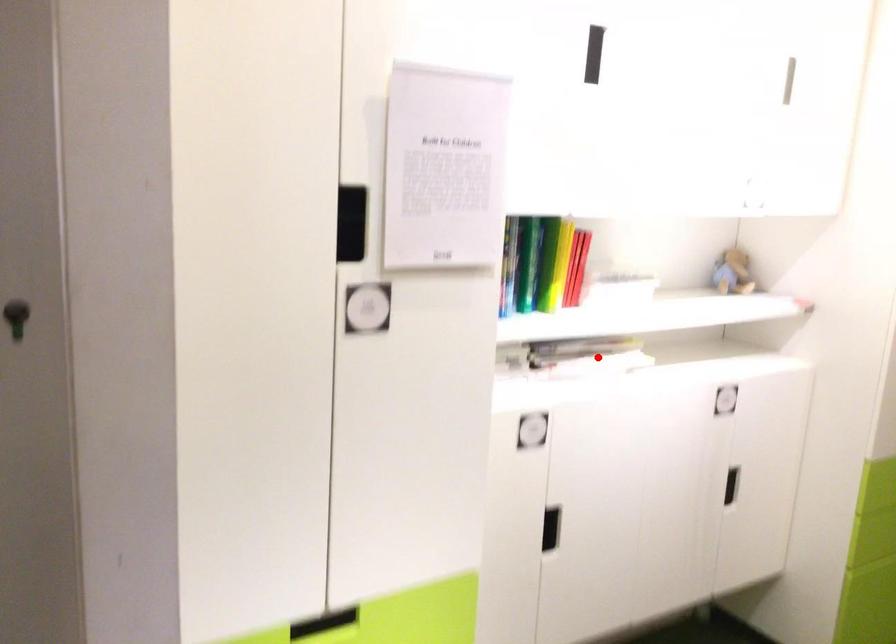
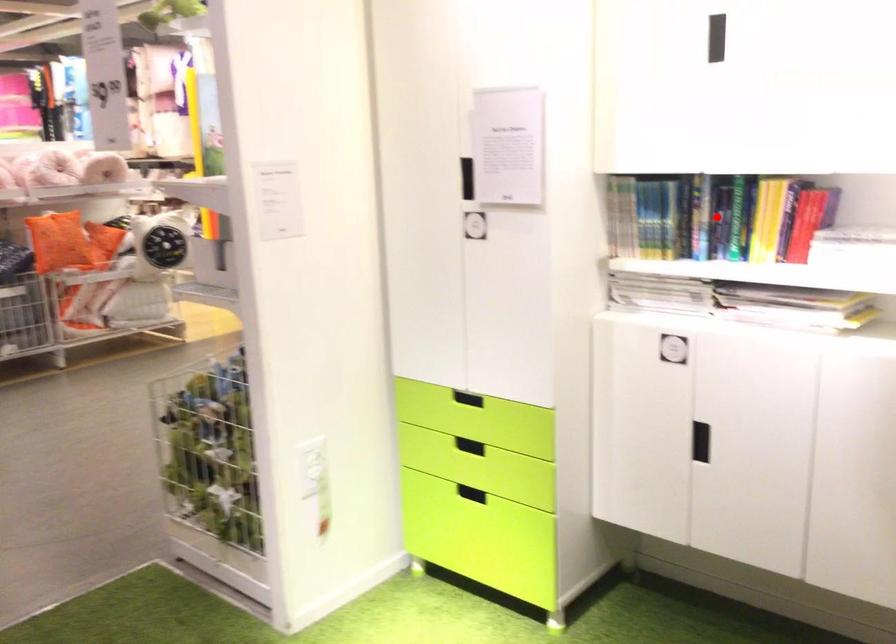
I am providing you with two images of the same scene from different viewpoints. A red point is marked on the first image and another point is marked on the second image. Does the point marked in image1 correspond to the same location as the one in image2?

No